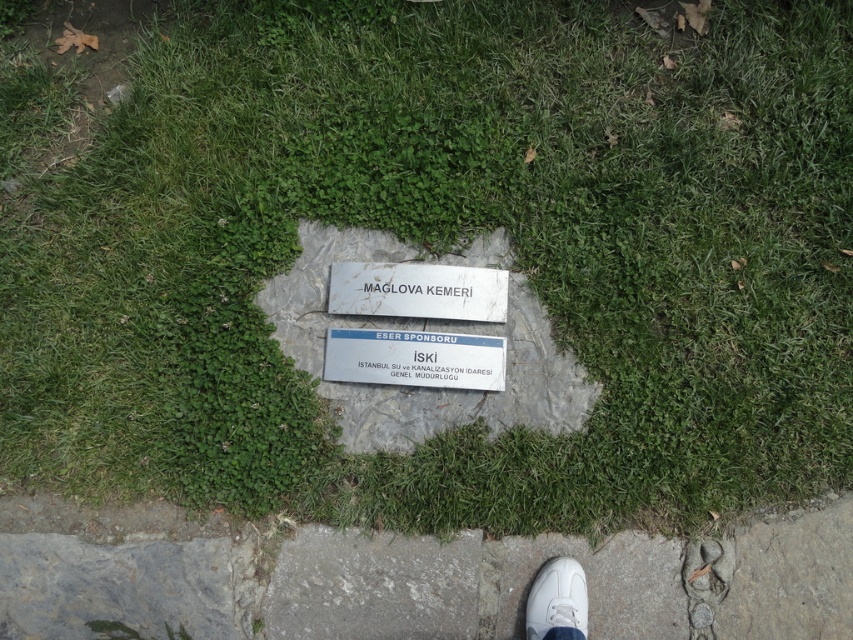
Question: Is white stone plaque at center closer to camera compared to white leather shoe at lower center?

Choices:
 (A) yes
 (B) no

Answer: (B)

Question: Which is farther from the white plastic sign at center?

Choices:
 (A) gray concrete pavement at lower center
 (B) white leather shoe at lower center

Answer: (B)

Question: Which object is the farthest from the gray concrete pavement at lower center?

Choices:
 (A) white plastic sign at center
 (B) white leather shoe at lower center

Answer: (A)

Question: Which of the following is the farthest from the observer?

Choices:
 (A) (563, 604)
 (B) (451, 387)

Answer: (B)

Question: Can you confirm if white stone plaque at center is positioned above white leather shoe at lower center?

Choices:
 (A) no
 (B) yes

Answer: (B)

Question: In this image, where is white plastic sign at center located relative to white leather shoe at lower center?

Choices:
 (A) below
 (B) above

Answer: (B)